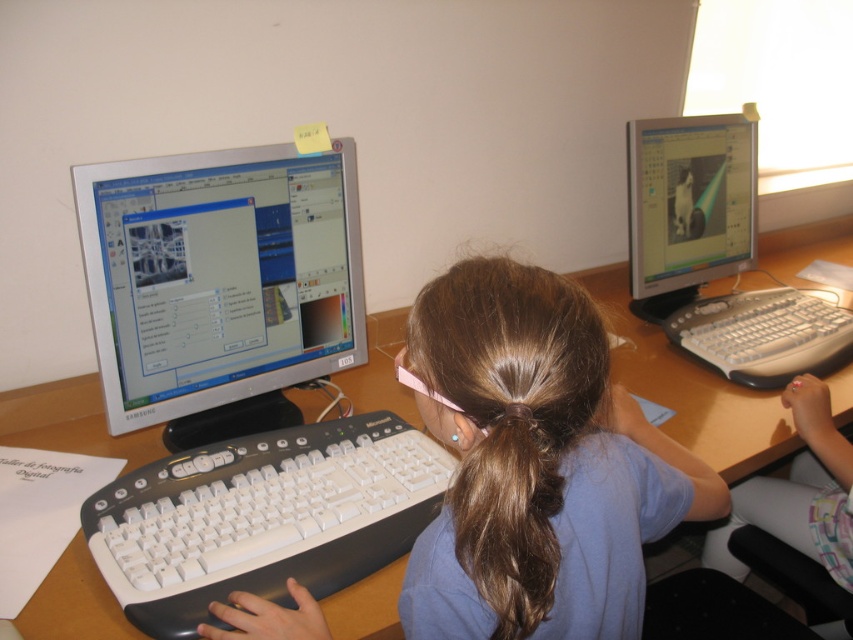
Question: Which object is positioned farthest from the brown silky hair at center?

Choices:
 (A) matte silver monitor at right
 (B) white plastic keyboard at center

Answer: (A)

Question: Is brown silky hair at center smaller than white plastic keyboard at right?

Choices:
 (A) yes
 (B) no

Answer: (A)

Question: Among these points, which one is nearest to the camera?

Choices:
 (A) (238, 518)
 (B) (844, 250)

Answer: (A)

Question: Which is nearer to the white plastic computer desk at center?

Choices:
 (A) brown hair at center
 (B) silver/black plastic monitor at left
 (C) white plastic keyboard at right
 (D) matte plastic monitor at upper right

Answer: (C)

Question: From the image, what is the correct spatial relationship of matte silver monitor at right in relation to matte plastic monitor at upper right?

Choices:
 (A) right
 (B) left

Answer: (A)

Question: Can you confirm if silver/black plastic monitor at left is thinner than matte plastic monitor at upper right?

Choices:
 (A) yes
 (B) no

Answer: (A)